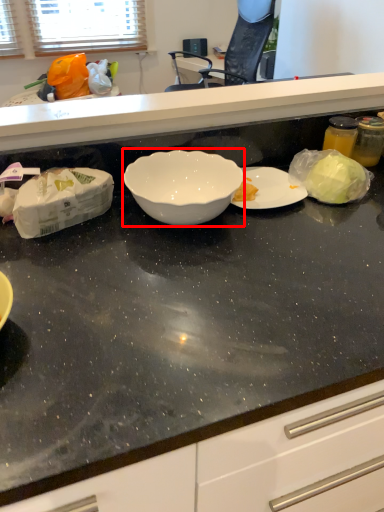
Question: From the image's perspective, what is the correct spatial relationship of bowl (annotated by the red box) in relation to countertop?

Choices:
 (A) above
 (B) below

Answer: (B)